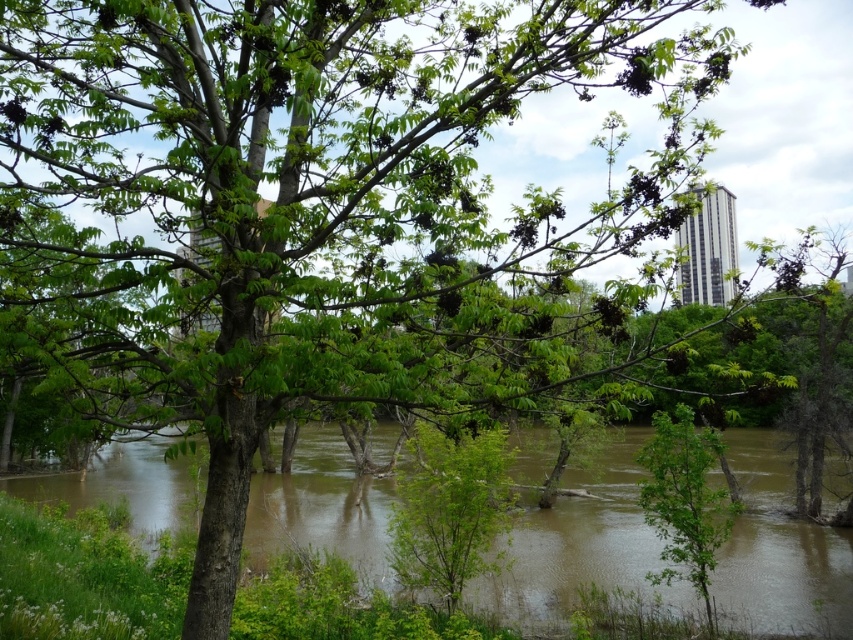
Does brown muddy water at lower left appear over green leafy tree at center?

Incorrect, brown muddy water at lower left is not positioned above green leafy tree at center.

Can you confirm if brown muddy water at lower left is wider than green leafy tree at center?

Correct, the width of brown muddy water at lower left exceeds that of green leafy tree at center.

Who is more forward, (289,532) or (450,508)?

Positioned in front is point (450,508).

Identify the location of brown muddy water at lower left. This screenshot has width=853, height=640. (581, 541).